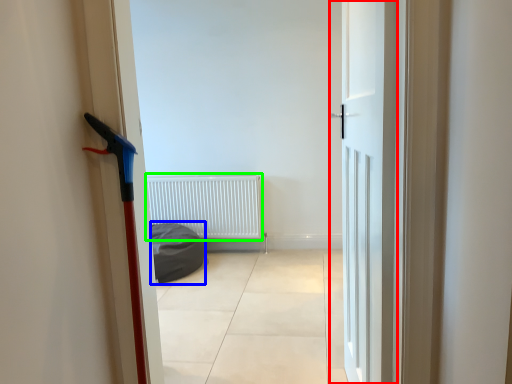
Question: Considering the real-world distances, which object is closest to door (highlighted by a red box)? sleeping bag (highlighted by a blue box) or radiator (highlighted by a green box).

Choices:
 (A) sleeping bag
 (B) radiator

Answer: (A)